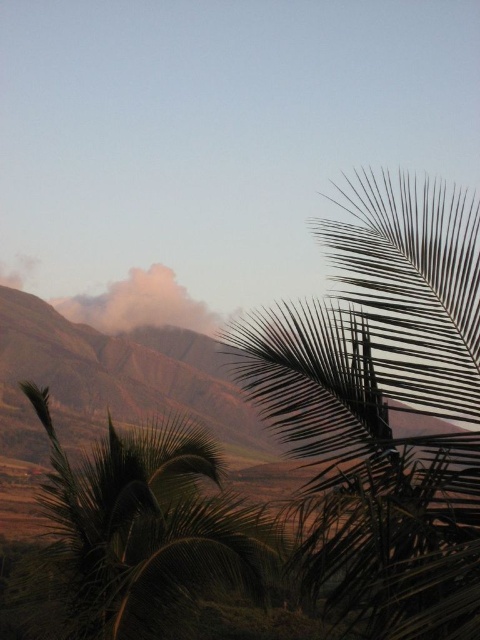
Between dark green leafy palm at right and green leafy palm at lower left, which one is positioned higher?

Positioned higher is dark green leafy palm at right.

Does dark green leafy palm at right appear under green leafy palm at lower left?

No, dark green leafy palm at right is not below green leafy palm at lower left.

In order to click on dark green leafy palm at right in this screenshot , I will do `click(384, 406)`.